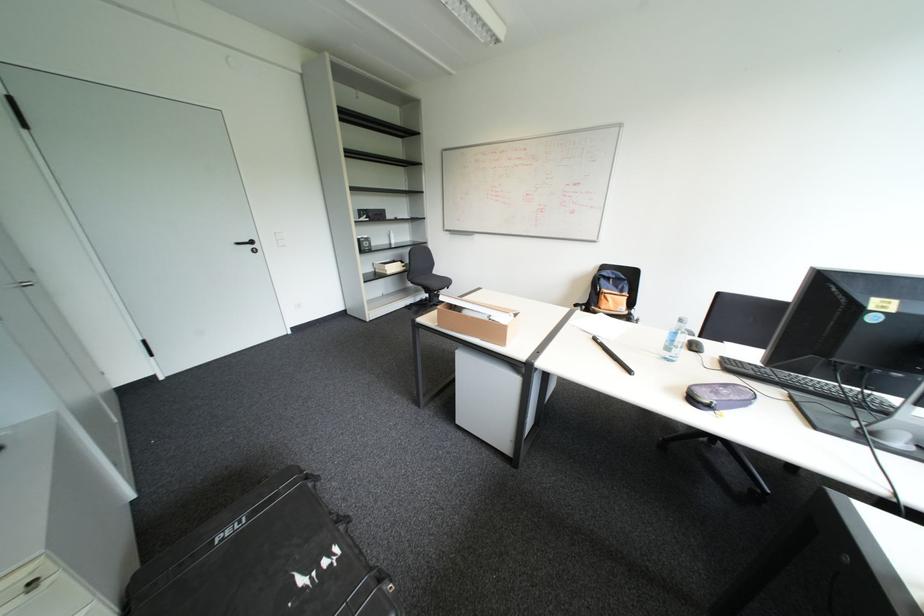
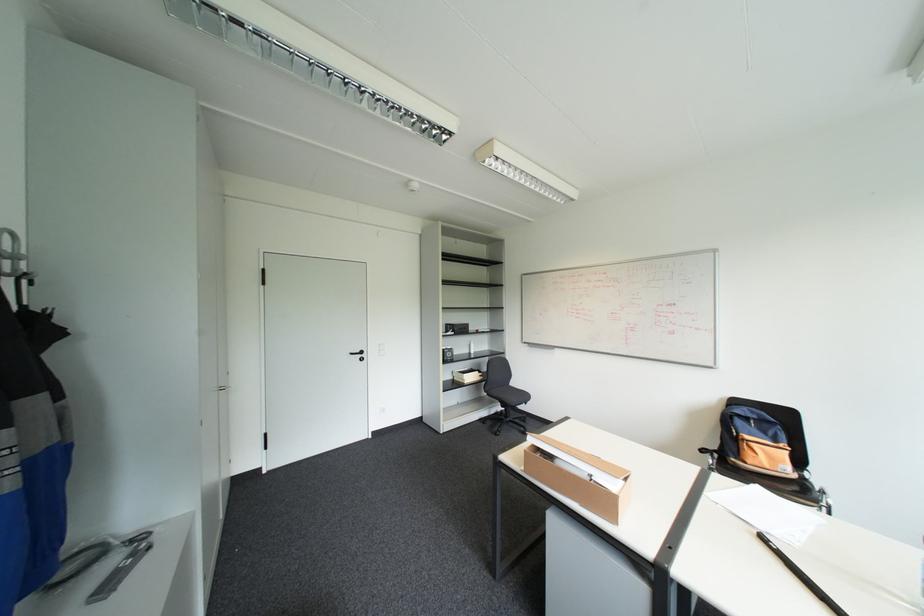
In the second image, find the point that corresponds to (246,243) in the first image.

(359, 353)